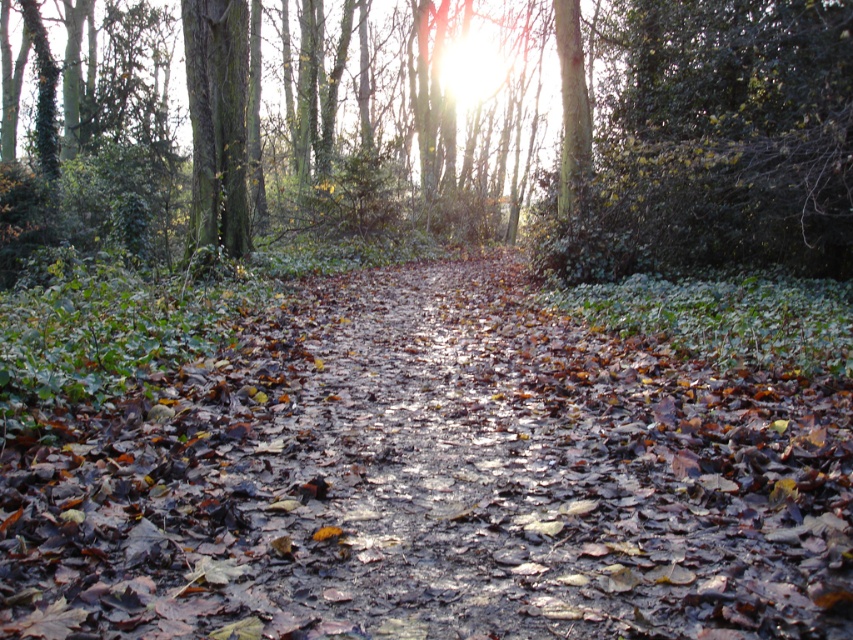
Question: Which object appears farthest from the camera in this image?

Choices:
 (A) green rough bark tree at center
 (B) green mossy tree trunk at left

Answer: (B)

Question: Does green rough bark tree at center appear on the left side of green mossy tree trunk at left?

Choices:
 (A) no
 (B) yes

Answer: (B)

Question: Does green rough bark tree at center have a lesser width compared to green mossy tree trunk at left?

Choices:
 (A) no
 (B) yes

Answer: (A)

Question: Which of the following is the closest to the observer?

Choices:
 (A) (213, 243)
 (B) (578, 180)

Answer: (A)

Question: Considering the relative positions of green rough bark tree at center and green mossy tree trunk at left in the image provided, where is green rough bark tree at center located with respect to green mossy tree trunk at left?

Choices:
 (A) right
 (B) left

Answer: (B)